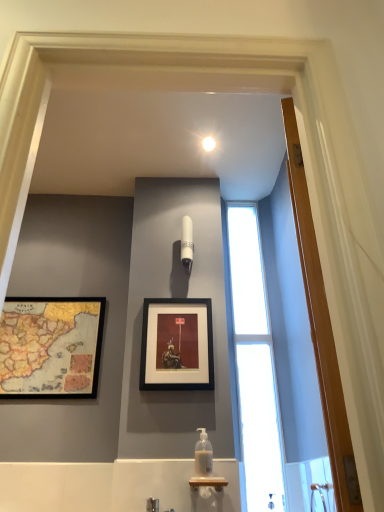
The height and width of the screenshot is (512, 384). What are the coordinates of `vacant space situated on the left part of white glossy light fixture at upper center` in the screenshot? It's located at (189, 144).